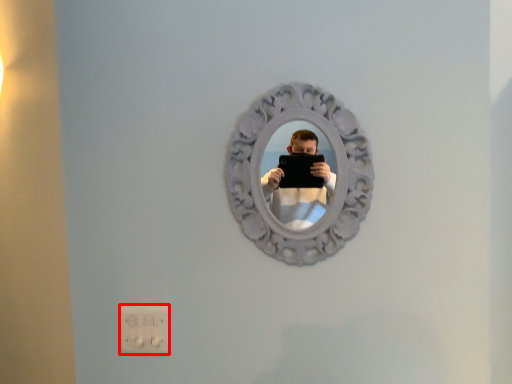
Question: From the image's perspective, what is the correct spatial positioning of electric outlet (annotated by the red box) in reference to view mirror?

Choices:
 (A) above
 (B) below

Answer: (B)